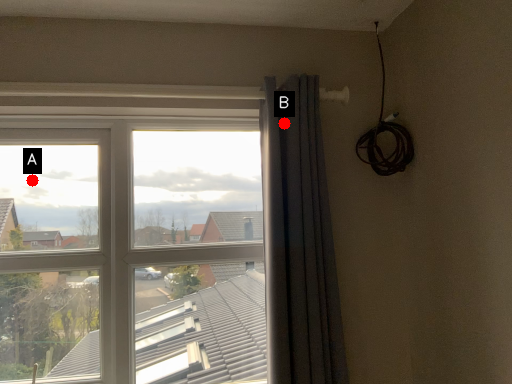
Question: Two points are circled on the image, labeled by A and B beside each circle. Which point appears farthest from the camera in this image?

Choices:
 (A) A is further
 (B) B is further

Answer: (A)